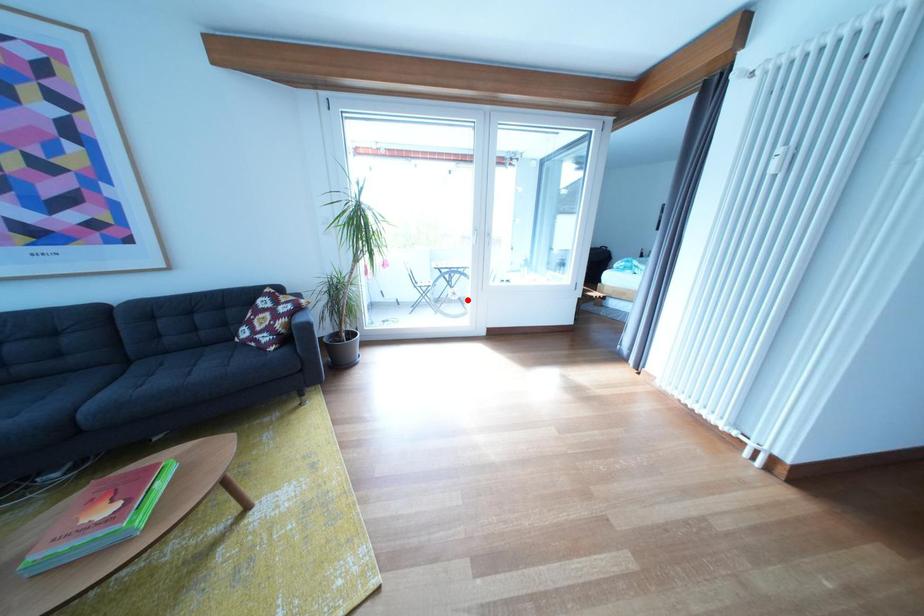
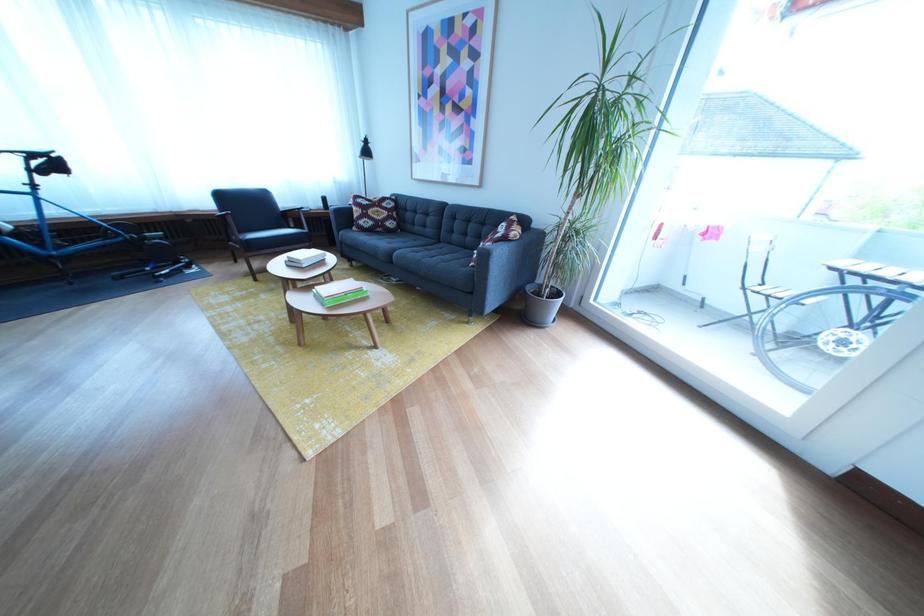
In the second image, find the point that corresponds to the highlighted location in the first image.

(857, 349)